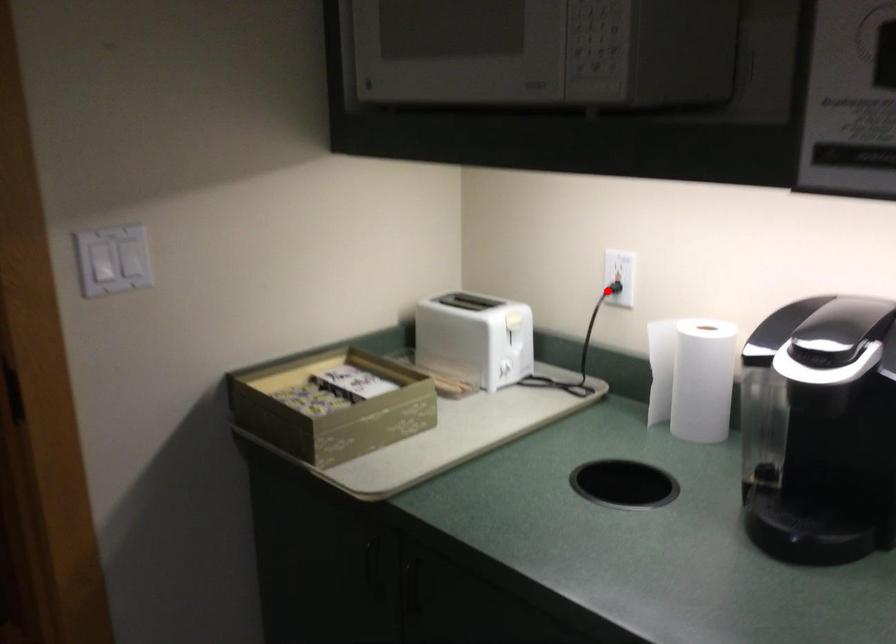
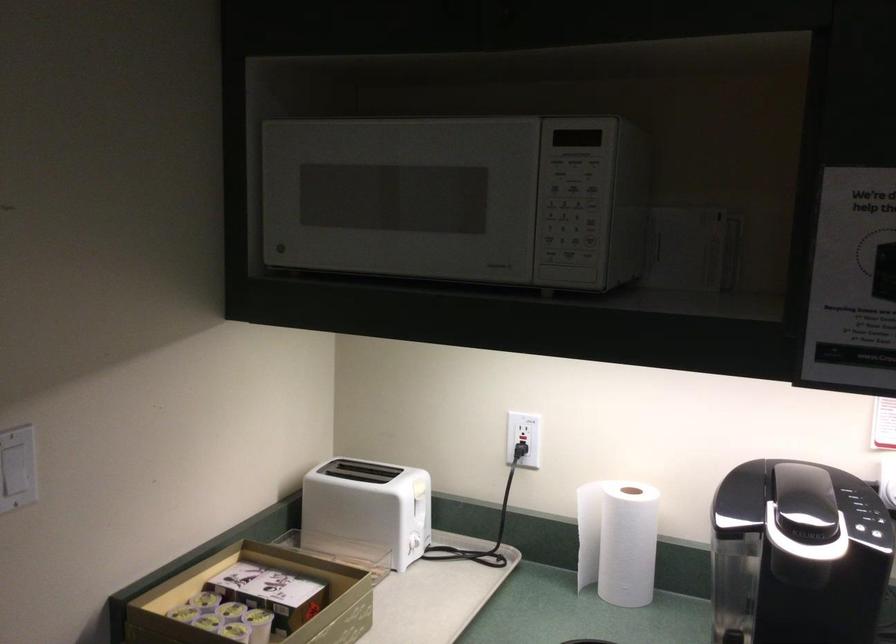
The point at the highlighted location is marked in the first image. Where is the corresponding point in the second image?

(521, 456)